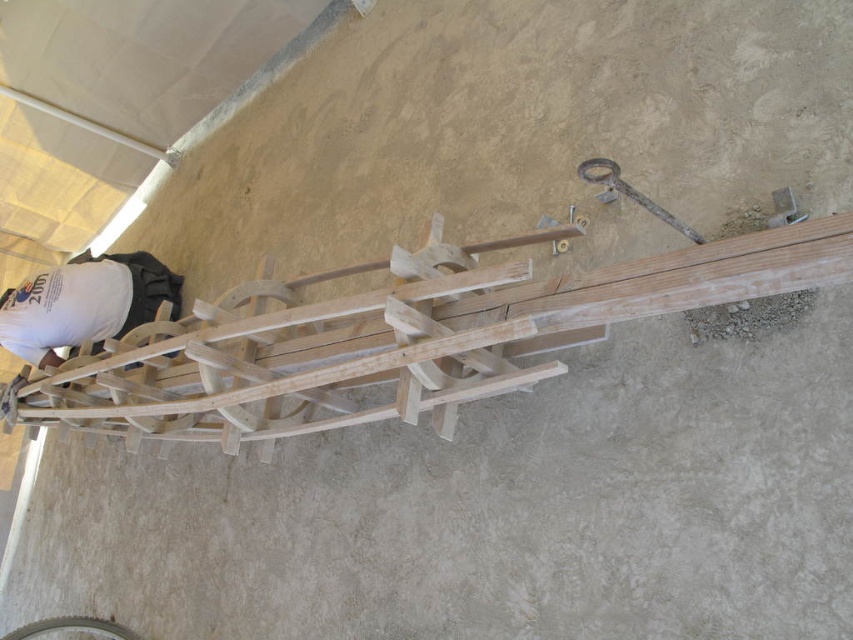
Question: Is the position of natural wood rail at center more distant than that of white matte shirt at upper left?

Choices:
 (A) yes
 (B) no

Answer: (B)

Question: Which object appears closest to the camera in this image?

Choices:
 (A) white matte shirt at upper left
 (B) natural wood rail at center

Answer: (B)

Question: Which point is farther from the camera taking this photo?

Choices:
 (A) (849, 250)
 (B) (165, 298)

Answer: (B)

Question: Is natural wood rail at center bigger than white matte shirt at upper left?

Choices:
 (A) yes
 (B) no

Answer: (A)

Question: Which object is closer to the camera taking this photo?

Choices:
 (A) white matte shirt at upper left
 (B) natural wood rail at center

Answer: (B)

Question: Is natural wood rail at center closer to camera compared to white matte shirt at upper left?

Choices:
 (A) no
 (B) yes

Answer: (B)